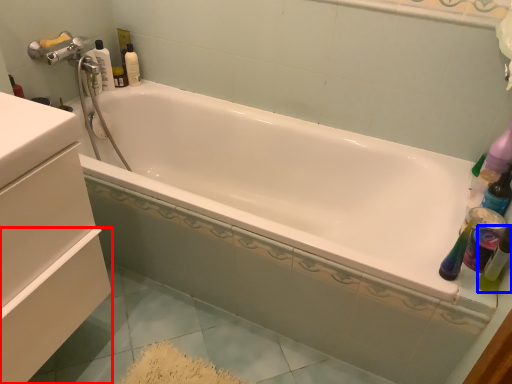
Question: Which of the following is the closest to the observer, drawer (highlighted by a red box) or mouthwash (highlighted by a blue box)?

Choices:
 (A) drawer
 (B) mouthwash

Answer: (A)